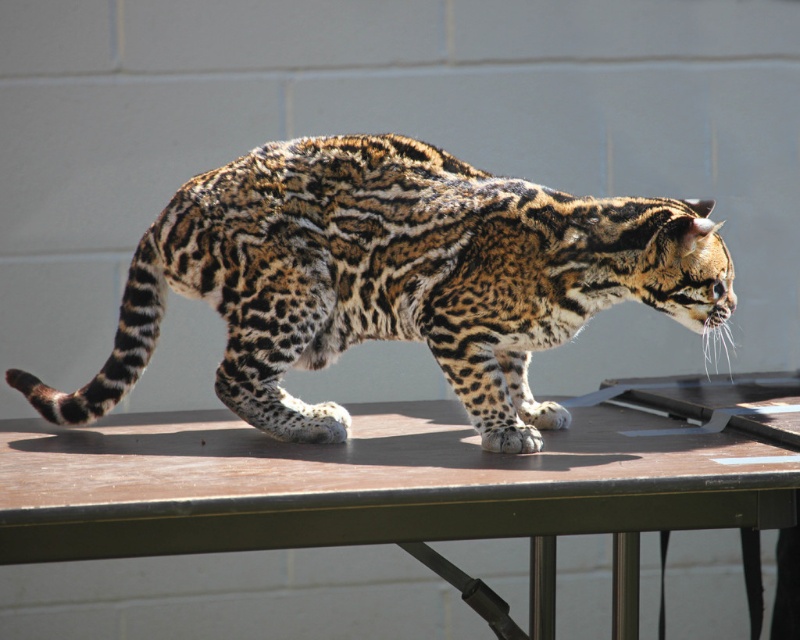
You are standing at the point with coordinates point (x=654, y=272) and want to walk to the point (x=200, y=538). Based on the scene description, will you need to walk forward or backward to reach your destination?

Since point (x=654, y=272) is behind point (x=200, y=538), you will need to walk forward to reach the destination.

You are a photographer setting up a photo shoot. You have a leopard print fur cat at center and a brown wood table at center in your scene. You need to ensure the cat fits entirely on the table. Based on their sizes, can the cat comfortably fit on the table?

The leopard print fur cat at center is smaller than the brown wood table at center, so the cat can comfortably fit on the table.